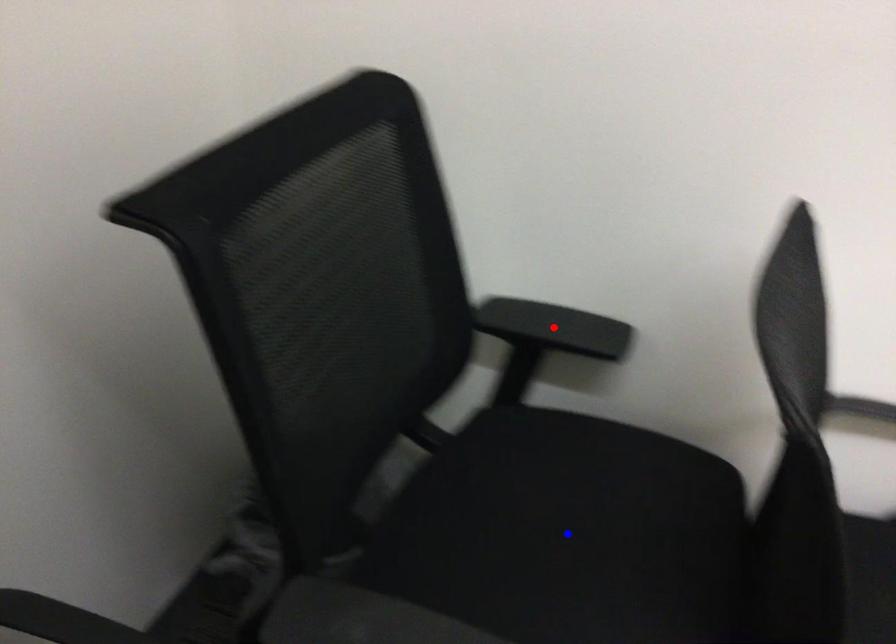
Question: In the image, two points are highlighted. Which point is nearer to the camera? Reply with the corresponding letter.

Choices:
 (A) blue point
 (B) red point

Answer: (A)